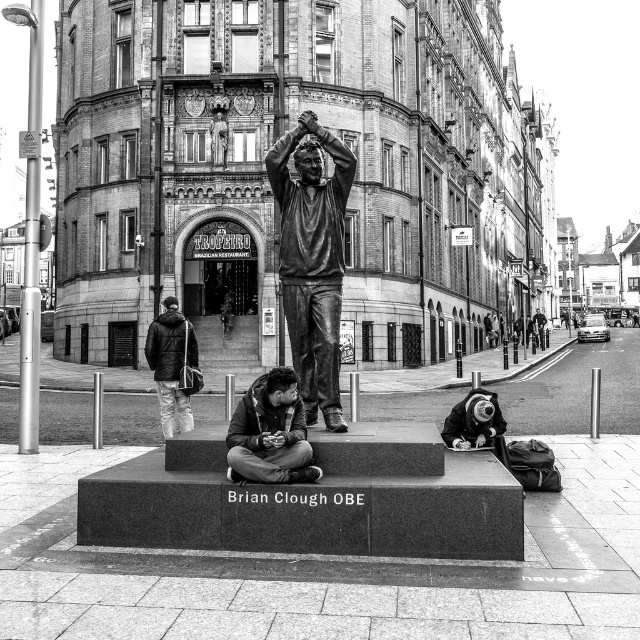
Question: Can you confirm if dark brown leather jacket at center is bigger than dark gray jacket at left?

Choices:
 (A) no
 (B) yes

Answer: (A)

Question: Does dark brown leather jacket at center come behind dark gray jacket at left?

Choices:
 (A) no
 (B) yes

Answer: (A)

Question: Which object appears closest to the camera in this image?

Choices:
 (A) bronze statue at center
 (B) dark brown leather jacket at center

Answer: (B)

Question: Which of these objects is positioned farthest from the dark gray jacket at left?

Choices:
 (A) bronze statue at center
 (B) dark brown leather jacket at center

Answer: (B)

Question: Does bronze statue at center appear under dark gray jacket at left?

Choices:
 (A) no
 (B) yes

Answer: (A)

Question: Among these points, which one is nearest to the camera?

Choices:
 (A) (227, 433)
 (B) (172, 410)
 (C) (308, 419)

Answer: (A)